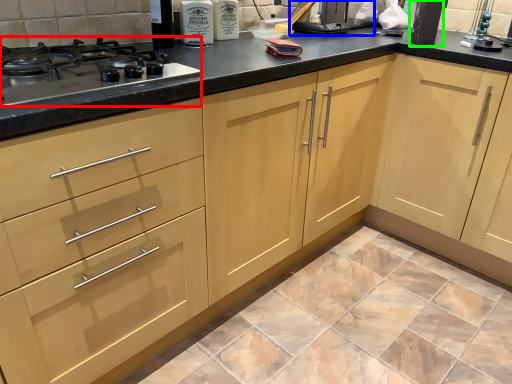
Question: Which object is positioned farthest from gas stove (highlighted by a red box)? Select from appliance (highlighted by a blue box) and appliance (highlighted by a green box).

Choices:
 (A) appliance
 (B) appliance

Answer: (B)